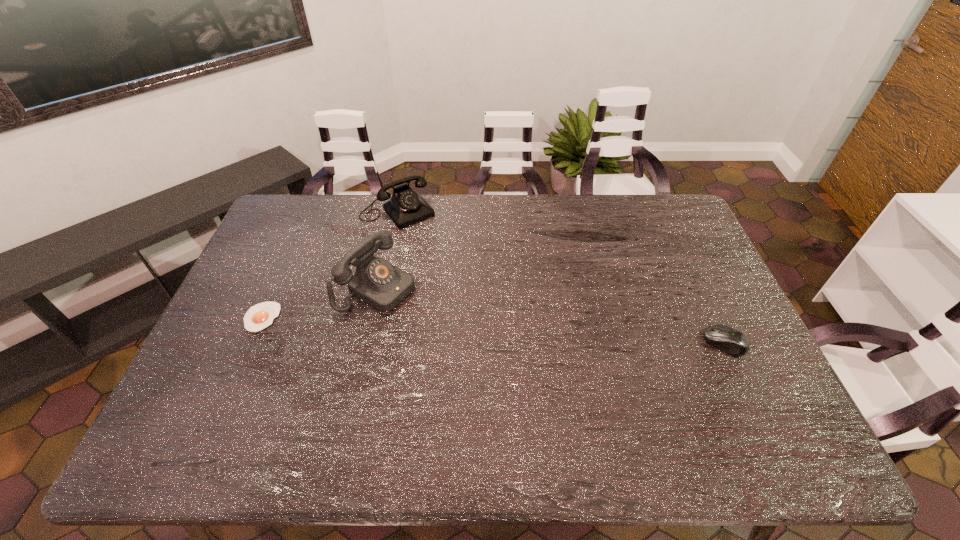
The width and height of the screenshot is (960, 540). Find the location of `vacant region located 0.400m on the dial of the taller telephone`. vacant region located 0.400m on the dial of the taller telephone is located at coordinates (521, 367).

Where is `vacant area situated on the dial of the taller telephone`? vacant area situated on the dial of the taller telephone is located at coordinates (463, 334).

Identify the location of free region located on the dial of the taller telephone. This screenshot has height=540, width=960. (463, 334).

Locate an element on the screen. free location located on the front face of the farthest object is located at coordinates (437, 252).

Where is `free region located 0.320m on the front face of the farthest object`? The height and width of the screenshot is (540, 960). free region located 0.320m on the front face of the farthest object is located at coordinates (461, 281).

Locate an element on the screen. Image resolution: width=960 pixels, height=540 pixels. free space located 0.320m on the front face of the farthest object is located at coordinates (461, 281).

What are the coordinates of `object at the far edge` in the screenshot? It's located at (406, 207).

Where is `object located in the left edge section of the desktop`? This screenshot has height=540, width=960. object located in the left edge section of the desktop is located at coordinates (259, 316).

I want to click on object at the right edge, so click(x=727, y=339).

At what (x,y) coordinates should I click in order to perform the action: click on blank area at the far edge. Please return your answer as a coordinate pair (x, y). This screenshot has width=960, height=540. Looking at the image, I should click on (498, 227).